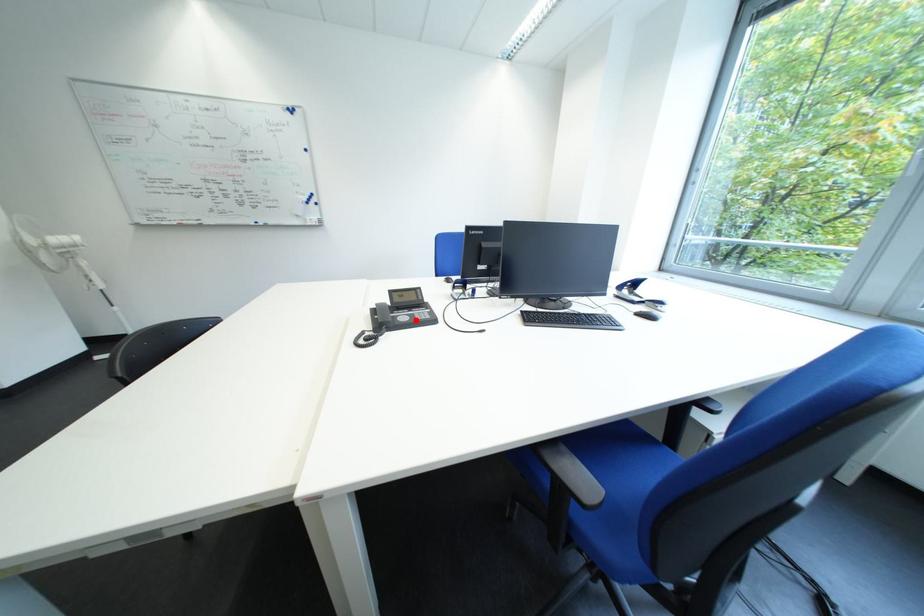
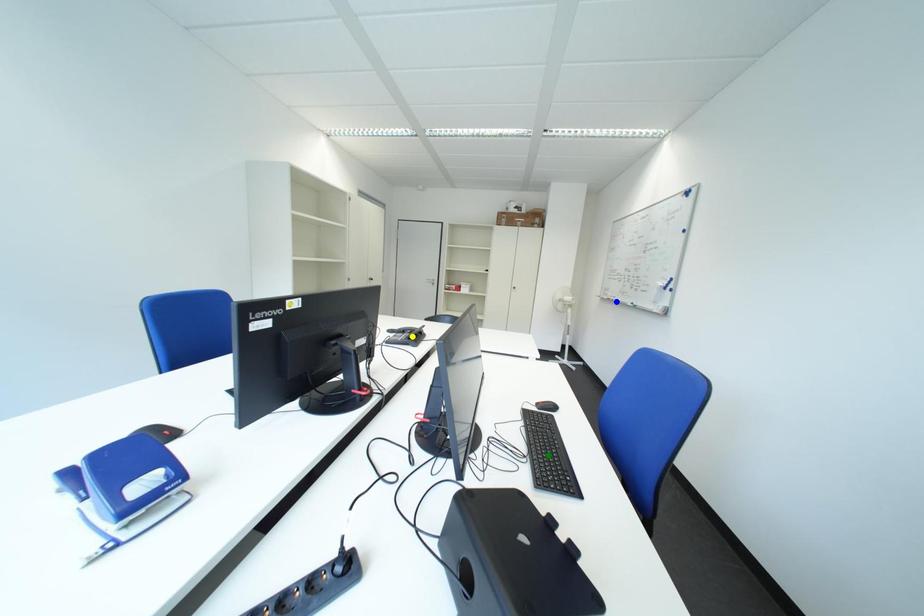
Question: I am providing you with two images of the same scene from different viewpoints. A red point is marked on the first image. You are given multiple points on the second image. Which point in image 2 is actually the same real-world point as the red point in image 1?

Choices:
 (A) yellow point
 (B) blue point
 (C) green point

Answer: (A)